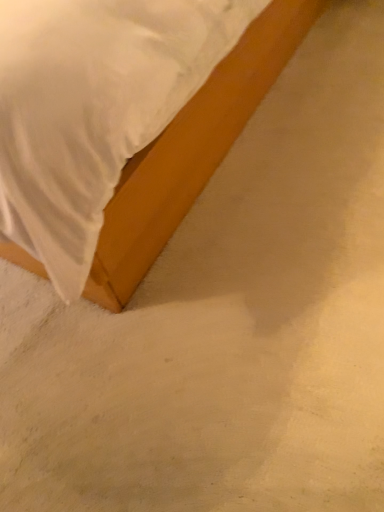
Describe the element at coordinates (191, 152) in the screenshot. I see `matte wood bed at center` at that location.

Locate an element on the screen. matte wood bed at center is located at coordinates (191, 152).

In order to click on matte wood bed at center in this screenshot , I will do `click(191, 152)`.